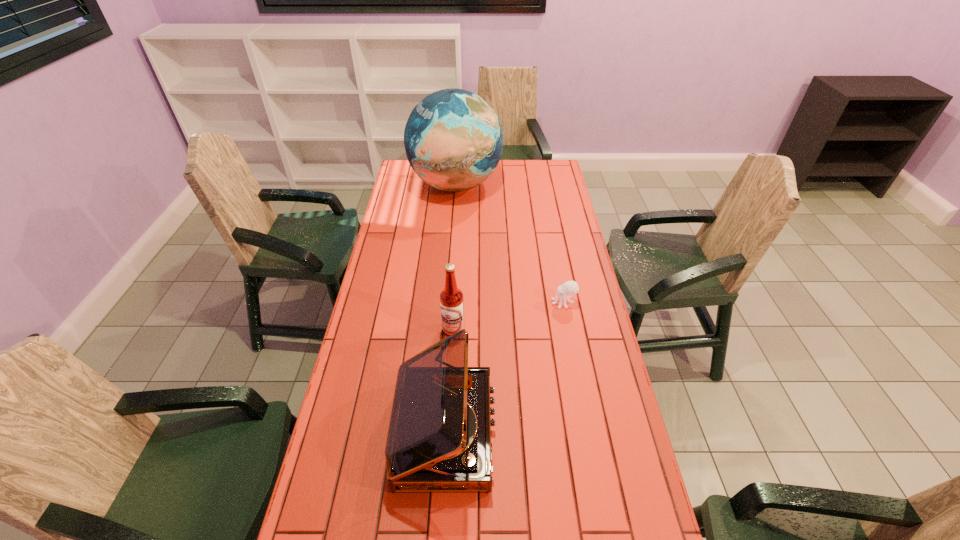
Where is `globe`? This screenshot has width=960, height=540. globe is located at coordinates (453, 139).

Locate an element on the screen. The height and width of the screenshot is (540, 960). the tallest object is located at coordinates (453, 139).

Locate an element on the screen. Image resolution: width=960 pixels, height=540 pixels. the second nearest object is located at coordinates (451, 298).

You are a GUI agent. You are given a task and a screenshot of the screen. Output one action in this format:
    pyautogui.click(x=<x>, y=<y>)
    Task: Click on the record player
    The image size is (960, 540).
    Given the screenshot: What is the action you would take?
    pyautogui.click(x=439, y=437)

Locate an element on the screen. This screenshot has width=960, height=540. the second farthest object is located at coordinates (569, 288).

Image resolution: width=960 pixels, height=540 pixels. Identify the location of the shortest object. (569, 288).

The image size is (960, 540). What are the coordinates of `free space located on the right of the tallest object` in the screenshot? It's located at (518, 185).

At what (x,y) coordinates should I click in order to perform the action: click on vacant area situated on the label side of the second nearest object. Please return your answer as a coordinate pair (x, y). Image resolution: width=960 pixels, height=540 pixels. Looking at the image, I should click on 447,440.

Where is `vacant point located on the front-facing side of the record player`? vacant point located on the front-facing side of the record player is located at coordinates (575, 432).

Find the location of `vacant space located 0.090m on the front-facing side of the rightmost object`. vacant space located 0.090m on the front-facing side of the rightmost object is located at coordinates (526, 302).